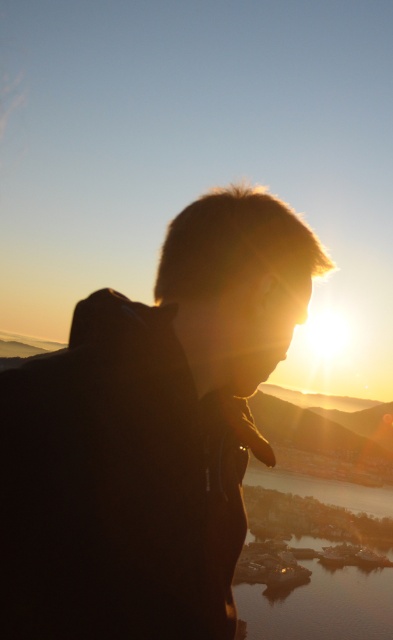
Is black matte jacket at center to the right of shiny reflective water at lower center from the viewer's perspective?

No, black matte jacket at center is not to the right of shiny reflective water at lower center.

Can you confirm if black matte jacket at center is positioned below shiny reflective water at lower center?

No.

What do you see at coordinates (150, 435) in the screenshot?
I see `black matte jacket at center` at bounding box center [150, 435].

Locate an element on the screen. The height and width of the screenshot is (640, 393). black matte jacket at center is located at coordinates (150, 435).